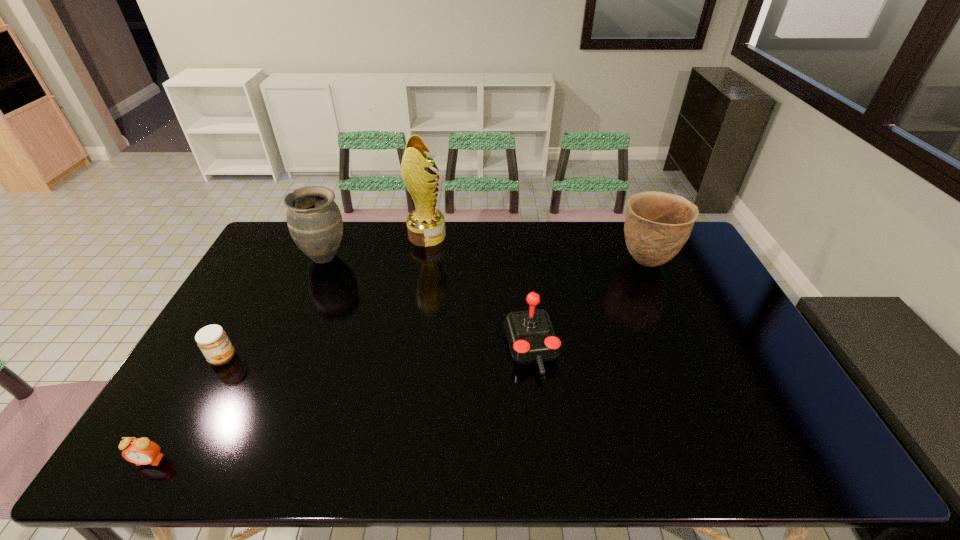
You are a GUI agent. You are given a task and a screenshot of the screen. Output one action in this format:
    pyautogui.click(x=<x>, y=<y>)
    Task: Click on the object present at the right edge
    The width and height of the screenshot is (960, 540).
    Given the screenshot: What is the action you would take?
    pyautogui.click(x=657, y=225)

At what (x,y) coordinates should I click in order to perform the action: click on object that is at the far left corner. Please return your answer as a coordinate pair (x, y). Image resolution: width=960 pixels, height=540 pixels. Looking at the image, I should click on (314, 220).

Where is `object at the near left corner`? This screenshot has width=960, height=540. object at the near left corner is located at coordinates (141, 451).

The height and width of the screenshot is (540, 960). What are the coordinates of `object positioned at the far right corner` in the screenshot? It's located at coord(657,225).

Find the location of a particular element. This screenshot has height=540, width=960. free space at the far edge of the desktop is located at coordinates (382, 258).

In the image, there is a desktop. In order to click on vacant space at the near edge in this screenshot , I will do `click(310, 461)`.

At what (x,y) coordinates should I click in order to perform the action: click on free space at the left edge. Please return your answer as a coordinate pair (x, y). The width and height of the screenshot is (960, 540). Looking at the image, I should click on (194, 399).

At what (x,y) coordinates should I click in order to perform the action: click on free spot at the far left corner of the desktop. Please return your answer as a coordinate pair (x, y). Image resolution: width=960 pixels, height=540 pixels. Looking at the image, I should click on (292, 240).

The width and height of the screenshot is (960, 540). In order to click on unoccupied position between the pottery and the award in this screenshot , I will do `click(537, 249)`.

You are a GUI agent. You are given a task and a screenshot of the screen. Output one action in this format:
    pyautogui.click(x=<x>, y=<y>)
    Task: Click on the empty space between the joystick and the rightmost object
    
    Given the screenshot: What is the action you would take?
    pyautogui.click(x=588, y=306)